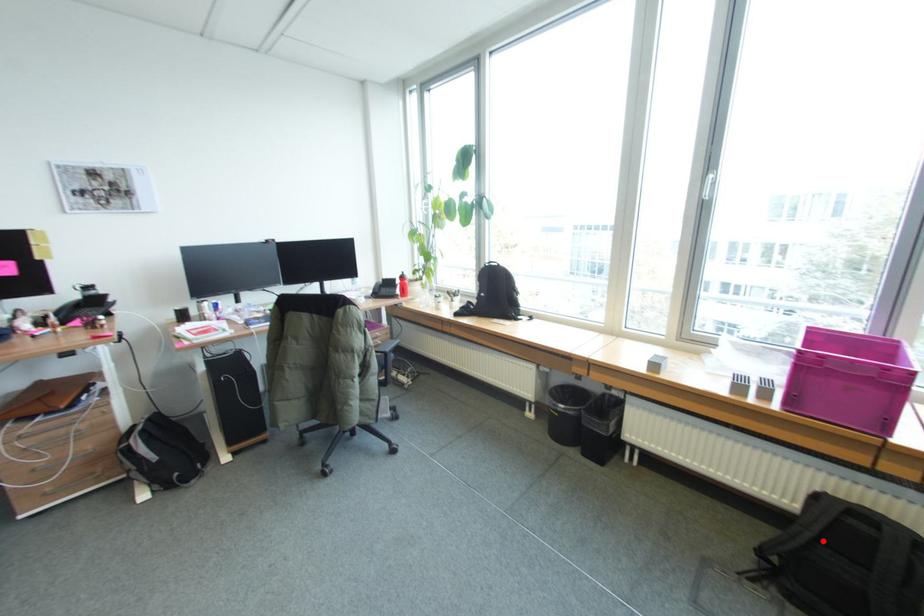
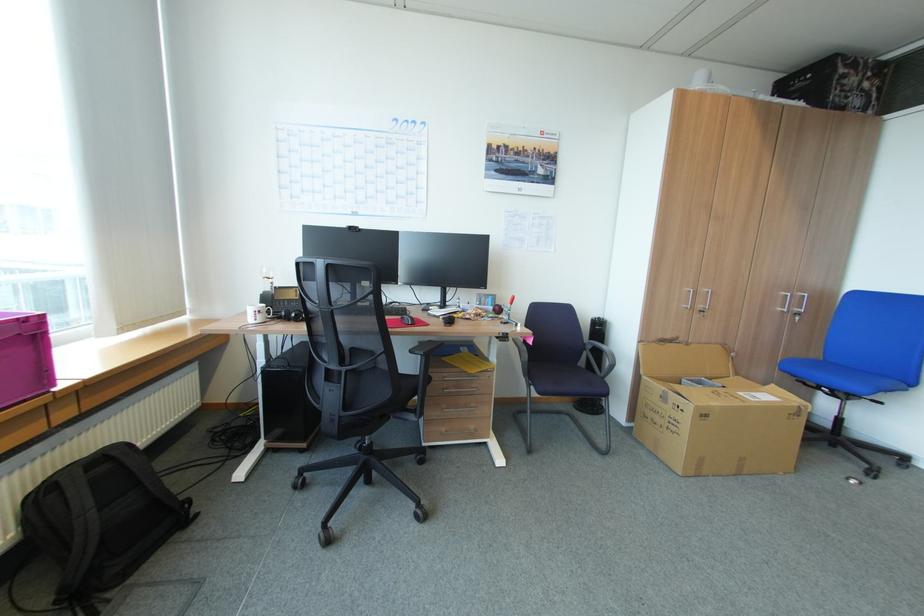
Question: A red point is marked in image1. In image2, is the corresponding 3D point closer to the camera or farther? Reply with the corresponding letter.

Choices:
 (A) The corresponding 3D point is closer.
 (B) The corresponding 3D point is farther.

Answer: (B)